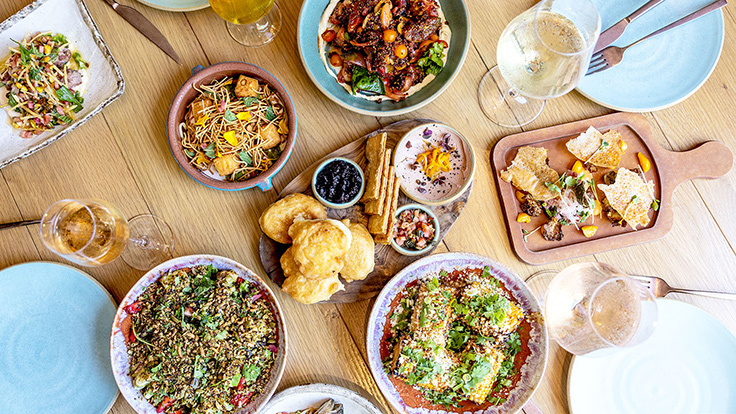
The width and height of the screenshot is (736, 414). Find the location of `wooden serving bowl`. wooden serving bowl is located at coordinates (353, 153).